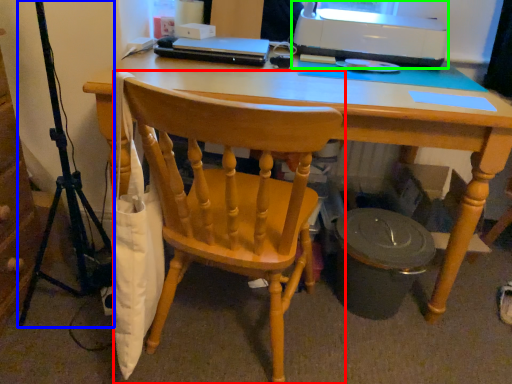
Question: Which object is the farthest from chair (highlighted by a red box)? Choose among these: tripod (highlighted by a blue box) or printer (highlighted by a green box).

Choices:
 (A) tripod
 (B) printer

Answer: (B)